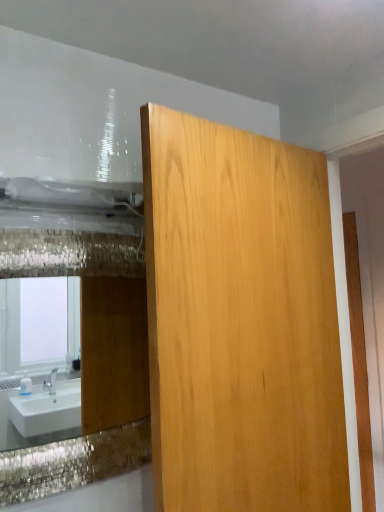
Question: Are shiny glass mirror at upper left and light wood panel at center far apart?

Choices:
 (A) yes
 (B) no

Answer: (A)

Question: Considering the relative sizes of shiny glass mirror at upper left and light wood panel at center in the image provided, is shiny glass mirror at upper left wider than light wood panel at center?

Choices:
 (A) yes
 (B) no

Answer: (B)

Question: Could you tell me if shiny glass mirror at upper left is facing light wood panel at center?

Choices:
 (A) no
 (B) yes

Answer: (A)

Question: From the image's perspective, is shiny glass mirror at upper left on light wood panel at center?

Choices:
 (A) no
 (B) yes

Answer: (A)

Question: Does shiny glass mirror at upper left appear on the left side of light wood panel at center?

Choices:
 (A) no
 (B) yes

Answer: (B)

Question: Is shiny glass mirror at upper left beside light wood panel at center?

Choices:
 (A) no
 (B) yes

Answer: (A)

Question: Does light wood panel at center have a lesser height compared to shiny glass mirror at upper left?

Choices:
 (A) yes
 (B) no

Answer: (B)

Question: Does light wood panel at center have a greater height compared to shiny glass mirror at upper left?

Choices:
 (A) no
 (B) yes

Answer: (B)

Question: Considering the relative sizes of light wood panel at center and shiny glass mirror at upper left in the image provided, is light wood panel at center wider than shiny glass mirror at upper left?

Choices:
 (A) no
 (B) yes

Answer: (B)

Question: Does light wood panel at center contain shiny glass mirror at upper left?

Choices:
 (A) yes
 (B) no

Answer: (B)

Question: Considering the relative positions of light wood panel at center and shiny glass mirror at upper left in the image provided, is light wood panel at center to the left of shiny glass mirror at upper left from the viewer's perspective?

Choices:
 (A) no
 (B) yes

Answer: (A)

Question: Is light wood panel at center positioned with its back to shiny glass mirror at upper left?

Choices:
 (A) yes
 (B) no

Answer: (A)

Question: Is shiny glass mirror at upper left bigger or smaller than light wood panel at center?

Choices:
 (A) small
 (B) big

Answer: (A)